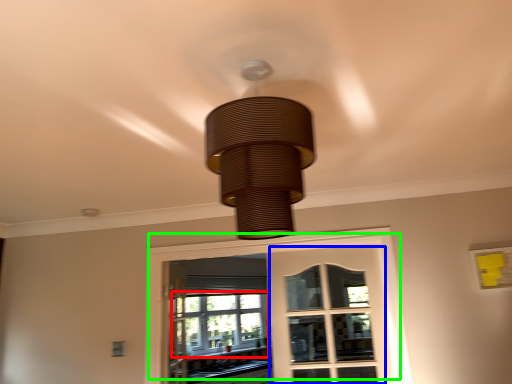
Question: Based on their relative distances, which object is nearer to bay window (highlighted by a red box)? Choose from screen door (highlighted by a blue box) and window (highlighted by a green box).

Choices:
 (A) screen door
 (B) window

Answer: (A)